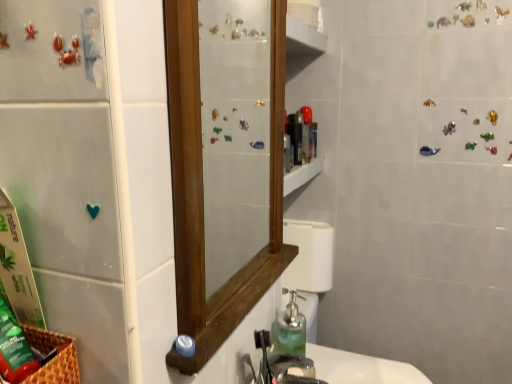
What are the coordinates of `free location to the right of translucent glass soap dispenser at lower center` in the screenshot? It's located at (349, 364).